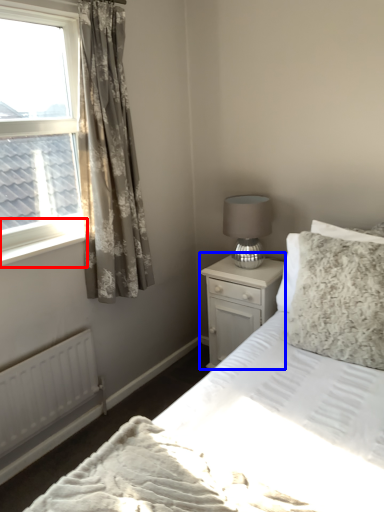
Question: Which point is further to the camera, window sill (highlighted by a red box) or nightstand (highlighted by a blue box)?

Choices:
 (A) window sill
 (B) nightstand

Answer: (B)